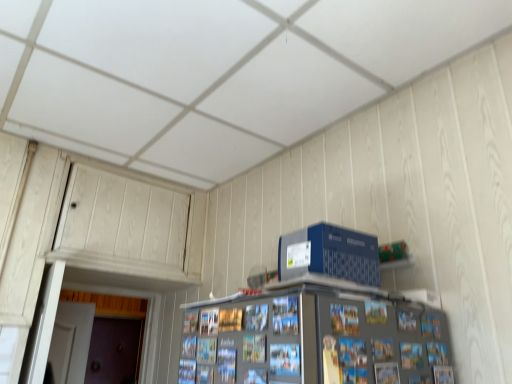
The height and width of the screenshot is (384, 512). I want to click on blue plastic computer at upper right, so click(x=330, y=254).

From the picture: Measure the distance between blue plastic computer at upper right and camera.

The distance of blue plastic computer at upper right from camera is 3.50 feet.

The height and width of the screenshot is (384, 512). What do you see at coordinates (330, 254) in the screenshot?
I see `blue plastic computer at upper right` at bounding box center [330, 254].

Image resolution: width=512 pixels, height=384 pixels. What do you see at coordinates (113, 351) in the screenshot?
I see `brown matte door at lower left` at bounding box center [113, 351].

This screenshot has height=384, width=512. Identify the location of brown matte door at lower left. (113, 351).

The height and width of the screenshot is (384, 512). Find the location of `blue plastic computer at upper right`. blue plastic computer at upper right is located at coordinates (330, 254).

Does brown matte door at lower left appear on the left side of blue plastic computer at upper right?

Correct, you'll find brown matte door at lower left to the left of blue plastic computer at upper right.

Which is behind, brown matte door at lower left or blue plastic computer at upper right?

brown matte door at lower left is behind.

Is point (100, 369) more distant than point (373, 279)?

Yes.

From the image's perspective, would you say brown matte door at lower left is shown under blue plastic computer at upper right?

Yes, from the image's perspective, brown matte door at lower left is beneath blue plastic computer at upper right.

From a real-world perspective, is brown matte door at lower left positioned above or below blue plastic computer at upper right?

brown matte door at lower left is situated lower than blue plastic computer at upper right in the real world.

Is brown matte door at lower left wider than blue plastic computer at upper right?

Incorrect, the width of brown matte door at lower left does not surpass that of blue plastic computer at upper right.

Can you confirm if brown matte door at lower left is shorter than blue plastic computer at upper right?

No, brown matte door at lower left is not shorter than blue plastic computer at upper right.

Considering the relative sizes of brown matte door at lower left and blue plastic computer at upper right in the image provided, is brown matte door at lower left bigger than blue plastic computer at upper right?

Indeed, brown matte door at lower left has a larger size compared to blue plastic computer at upper right.

Is brown matte door at lower left completely or partially outside of blue plastic computer at upper right?

Indeed, brown matte door at lower left is completely outside blue plastic computer at upper right.

Is brown matte door at lower left next to blue plastic computer at upper right?

No, brown matte door at lower left is not touching blue plastic computer at upper right.

Is brown matte door at lower left looking in the opposite direction of blue plastic computer at upper right?

No, blue plastic computer at upper right is not at the back of brown matte door at lower left.

What's the angular difference between brown matte door at lower left and blue plastic computer at upper right's facing directions?

They differ by 88.1 degrees in their facing directions.

Measure the distance from brown matte door at lower left to blue plastic computer at upper right.

The distance of brown matte door at lower left from blue plastic computer at upper right is 11.68 feet.

I want to click on computer lying on the right of brown matte door at lower left, so click(330, 254).

Which is more to the left, blue plastic computer at upper right or brown matte door at lower left?

brown matte door at lower left is more to the left.

In the scene shown: Which object is more forward, blue plastic computer at upper right or brown matte door at lower left?

Positioned in front is blue plastic computer at upper right.

Considering the positions of points (352, 245) and (97, 319), is point (352, 245) farther from camera compared to point (97, 319)?

No, it is in front of (97, 319).

In the scene shown: From the image's perspective, between blue plastic computer at upper right and brown matte door at lower left, who is located below?

brown matte door at lower left, from the image's perspective.

From a real-world perspective, between blue plastic computer at upper right and brown matte door at lower left, who is vertically lower?

brown matte door at lower left.

Based on the photo, considering the sizes of objects blue plastic computer at upper right and brown matte door at lower left in the image provided, who is wider, blue plastic computer at upper right or brown matte door at lower left?

With larger width is blue plastic computer at upper right.

Who is shorter, blue plastic computer at upper right or brown matte door at lower left?

blue plastic computer at upper right.

Is blue plastic computer at upper right smaller than brown matte door at lower left?

Indeed, blue plastic computer at upper right has a smaller size compared to brown matte door at lower left.

Is blue plastic computer at upper right situated inside brown matte door at lower left or outside?

blue plastic computer at upper right is located beyond the bounds of brown matte door at lower left.

Are blue plastic computer at upper right and brown matte door at lower left beside each other?

blue plastic computer at upper right is not next to brown matte door at lower left, and they're not touching.

Is blue plastic computer at upper right oriented towards brown matte door at lower left?

No.

How different are the orientations of blue plastic computer at upper right and brown matte door at lower left in degrees?

The facing directions of blue plastic computer at upper right and brown matte door at lower left are 88.1 degrees apart.

The image size is (512, 384). Find the location of `computer above the brown matte door at lower left (from the image's perspective)`. computer above the brown matte door at lower left (from the image's perspective) is located at coordinates [330, 254].

Find the location of `door on the left of blue plastic computer at upper right`. door on the left of blue plastic computer at upper right is located at coordinates (113, 351).

Find the location of `door below the blue plastic computer at upper right (from a real-world perspective)`. door below the blue plastic computer at upper right (from a real-world perspective) is located at coordinates (113, 351).